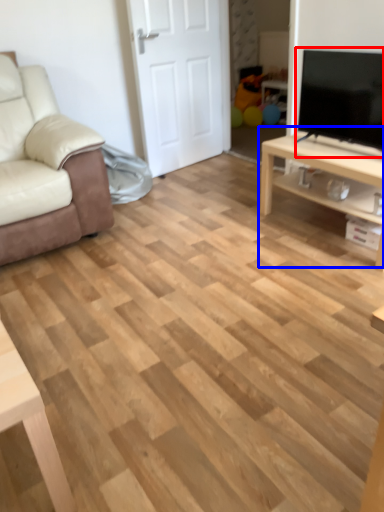
Question: Which point is closer to the camera, television (highlighted by a red box) or table (highlighted by a blue box)?

Choices:
 (A) television
 (B) table

Answer: (A)